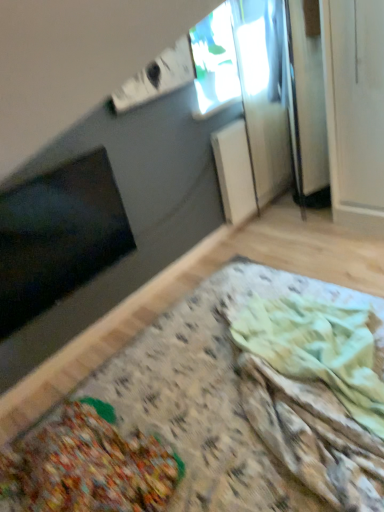
What do you see at coordinates (58, 236) in the screenshot?
I see `black matte window screen at lower left` at bounding box center [58, 236].

This screenshot has height=512, width=384. What are the coordinates of `black matte window screen at lower left` in the screenshot? It's located at (58, 236).

Describe the element at coordinates (317, 349) in the screenshot. I see `textured fabric blanket at lower center` at that location.

Find the location of a particular element. This screenshot has width=384, height=512. wooden table at lower left is located at coordinates (203, 420).

Image resolution: width=384 pixels, height=512 pixels. I want to click on transparent glass window at upper center, so click(x=214, y=63).

Is wooden table at lower left aimed at transparent glass window at upper center?

No, wooden table at lower left does not turn towards transparent glass window at upper center.

From a real-world perspective, is wooden table at lower left above or below transparent glass window at upper center?

wooden table at lower left is below transparent glass window at upper center.

Considering the sizes of wooden table at lower left and transparent glass window at upper center in the image, is wooden table at lower left wider or thinner than transparent glass window at upper center?

wooden table at lower left is wider than transparent glass window at upper center.

Choose the correct answer: Is black matte window screen at lower left inside transparent glass window at upper center or outside it?

A: black matte window screen at lower left is outside transparent glass window at upper center.

The width and height of the screenshot is (384, 512). Find the location of `window that appears on the right of black matte window screen at lower left`. window that appears on the right of black matte window screen at lower left is located at coordinates (214, 63).

Relative to transparent glass window at upper center, is black matte window screen at lower left in front or behind?

In the image, black matte window screen at lower left appears in front of transparent glass window at upper center.

Looking at the image, does black matte window screen at lower left seem bigger or smaller compared to transparent glass window at upper center?

Clearly, black matte window screen at lower left is larger in size than transparent glass window at upper center.

Which object is closer to the camera, black matte window screen at lower left or textured fabric blanket at lower center?

textured fabric blanket at lower center is in front.

Which is in front, point (78, 164) or point (266, 304)?

The point (266, 304) is in front.

You are a GUI agent. You are given a task and a screenshot of the screen. Output one action in this format:
    pyautogui.click(x=<x>, y=<y>)
    Task: Click on the food below the black matte window screen at lower left (from a real-world perspective)
    This screenshot has height=512, width=384.
    Given the screenshot: What is the action you would take?
    pyautogui.click(x=317, y=349)

Measure the distance between black matte window screen at lower left and textured fabric blanket at lower center.

They are 1.02 meters apart.

Locate an element on the screen. Image resolution: width=384 pixels, height=512 pixels. window screen below the transparent glass window at upper center (from the image's perspective) is located at coordinates (58, 236).

Is transparent glass window at upper center not near black matte window screen at lower left?

Yes, transparent glass window at upper center and black matte window screen at lower left are quite far apart.

Considering the positions of objects transparent glass window at upper center and black matte window screen at lower left in the image provided, who is more to the right, transparent glass window at upper center or black matte window screen at lower left?

From the viewer's perspective, transparent glass window at upper center appears more on the right side.

Considering the sizes of objects transparent glass window at upper center and black matte window screen at lower left in the image provided, who is wider, transparent glass window at upper center or black matte window screen at lower left?

transparent glass window at upper center is wider.

At what (x,y) coordinates should I click in order to perform the action: click on window screen to the left of textured fabric blanket at lower center. Please return your answer as a coordinate pair (x, y). This screenshot has width=384, height=512. Looking at the image, I should click on (58, 236).

Are textured fabric blanket at lower center and black matte window screen at lower left far apart?

That's right, there is a large distance between textured fabric blanket at lower center and black matte window screen at lower left.

From a real-world perspective, is textured fabric blanket at lower center under black matte window screen at lower left?

Indeed, from a real-world perspective, textured fabric blanket at lower center is positioned beneath black matte window screen at lower left.

Where is `table below the transparent glass window at upper center (from the image's perspective)`? Image resolution: width=384 pixels, height=512 pixels. table below the transparent glass window at upper center (from the image's perspective) is located at coordinates (203, 420).

Is wooden table at lower left surrounded by transparent glass window at upper center?

No, wooden table at lower left is located outside of transparent glass window at upper center.

Can you tell me how much transparent glass window at upper center and wooden table at lower left differ in facing direction?

The angle between the facing direction of transparent glass window at upper center and the facing direction of wooden table at lower left is 179 degrees.

Considering the sizes of objects transparent glass window at upper center and wooden table at lower left in the image provided, who is thinner, transparent glass window at upper center or wooden table at lower left?

With smaller width is transparent glass window at upper center.

Is textured fabric blanket at lower center next to transparent glass window at upper center and touching it?

textured fabric blanket at lower center is not next to transparent glass window at upper center, and they're not touching.

Can you confirm if textured fabric blanket at lower center is taller than transparent glass window at upper center?

Incorrect, the height of textured fabric blanket at lower center is not larger of that of transparent glass window at upper center.

From a real-world perspective, between textured fabric blanket at lower center and transparent glass window at upper center, who is vertically higher?

transparent glass window at upper center, from a real-world perspective.

From the image's perspective, is textured fabric blanket at lower center beneath transparent glass window at upper center?

Yes, from the image's perspective, textured fabric blanket at lower center is below transparent glass window at upper center.

Identify the location of table that appears on the left of transparent glass window at upper center. This screenshot has width=384, height=512. pos(203,420).

At what (x,y) coordinates should I click in order to perform the action: click on window on the right side of black matte window screen at lower left. Please return your answer as a coordinate pair (x, y). The width and height of the screenshot is (384, 512). Looking at the image, I should click on (214, 63).

From the image, which object appears to be nearer to black matte window screen at lower left, textured fabric blanket at lower center or wooden table at lower left?

wooden table at lower left is closer to black matte window screen at lower left.

Which object lies nearer to the anchor point textured fabric blanket at lower center, wooden table at lower left or black matte window screen at lower left?

Among the two, wooden table at lower left is located nearer to textured fabric blanket at lower center.

Which object lies nearer to the anchor point textured fabric blanket at lower center, black matte window screen at lower left or transparent glass window at upper center?

black matte window screen at lower left lies closer to textured fabric blanket at lower center than the other object.

Based on their spatial positions, is textured fabric blanket at lower center or transparent glass window at upper center closer to black matte window screen at lower left?

textured fabric blanket at lower center lies closer to black matte window screen at lower left than the other object.

Estimate the real-world distances between objects in this image. Which object is closer to textured fabric blanket at lower center, transparent glass window at upper center or black matte window screen at lower left?

black matte window screen at lower left lies closer to textured fabric blanket at lower center than the other object.

Based on their spatial positions, is textured fabric blanket at lower center or black matte window screen at lower left further from wooden table at lower left?

Based on the image, black matte window screen at lower left appears to be further to wooden table at lower left.

Which object lies nearer to the anchor point black matte window screen at lower left, transparent glass window at upper center or wooden table at lower left?

wooden table at lower left is positioned closer to the anchor black matte window screen at lower left.

Based on their spatial positions, is wooden table at lower left or black matte window screen at lower left closer to transparent glass window at upper center?

black matte window screen at lower left is positioned closer to the anchor transparent glass window at upper center.

Where is `food positioned between wooden table at lower left and transparent glass window at upper center from near to far`? food positioned between wooden table at lower left and transparent glass window at upper center from near to far is located at coordinates (317, 349).

The image size is (384, 512). In order to click on window screen positioned between wooden table at lower left and transparent glass window at upper center from near to far in this screenshot , I will do `click(58, 236)`.

I want to click on food positioned between wooden table at lower left and black matte window screen at lower left from near to far, so click(x=317, y=349).

At what (x,y) coordinates should I click in order to perform the action: click on window screen between transparent glass window at upper center and textured fabric blanket at lower center in the up-down direction. Please return your answer as a coordinate pair (x, y). The width and height of the screenshot is (384, 512). Looking at the image, I should click on (58, 236).